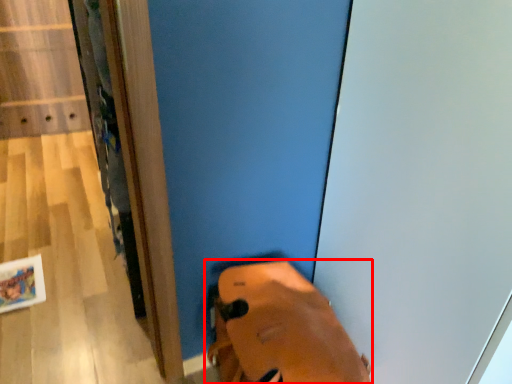
Question: From the image's perspective, what is the correct spatial positioning of footwear (annotated by the red box) in reference to screen door?

Choices:
 (A) below
 (B) above

Answer: (A)